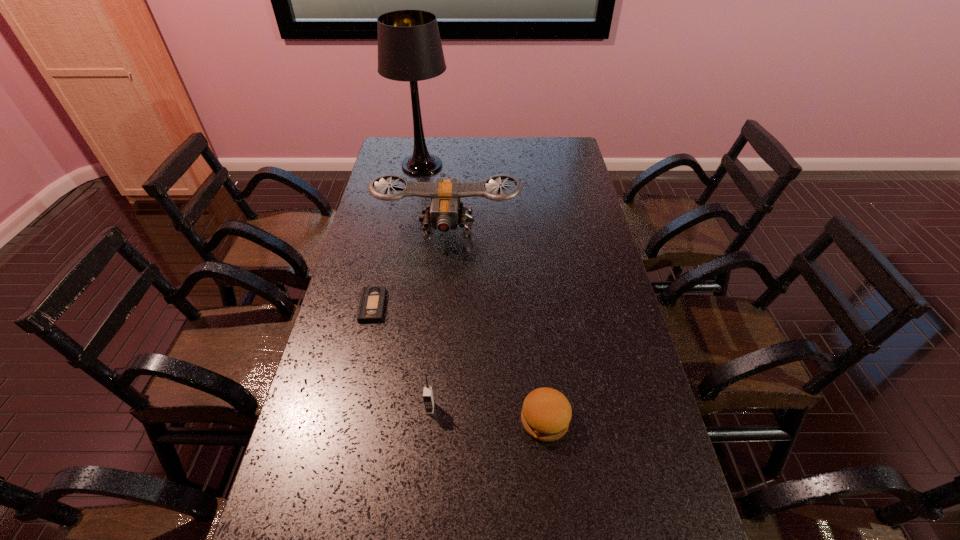
Find the location of a particular element. the tallest object is located at coordinates (409, 45).

Locate an element on the screen. the farthest object is located at coordinates (409, 45).

Find the location of a particular element. The width and height of the screenshot is (960, 540). the second tallest object is located at coordinates (443, 213).

This screenshot has width=960, height=540. I want to click on the fourth nearest object, so click(443, 213).

You are a GUI agent. You are given a task and a screenshot of the screen. Output one action in this format:
    pyautogui.click(x=<x>, y=<y>)
    Task: Click on the cellular telephone
    
    Given the screenshot: What is the action you would take?
    pyautogui.click(x=428, y=398)

The width and height of the screenshot is (960, 540). I want to click on hamburger, so click(546, 413).

Locate an element on the screen. This screenshot has width=960, height=540. the shortest object is located at coordinates (372, 302).

At what (x,y) coordinates should I click in order to perform the action: click on videotape. Please return your answer as a coordinate pair (x, y). The width and height of the screenshot is (960, 540). Looking at the image, I should click on (372, 302).

I want to click on vacant space situated on the back of the farthest object, so click(x=427, y=137).

The height and width of the screenshot is (540, 960). I want to click on free location located 0.110m on the front-facing side of the second farthest object, so click(x=444, y=278).